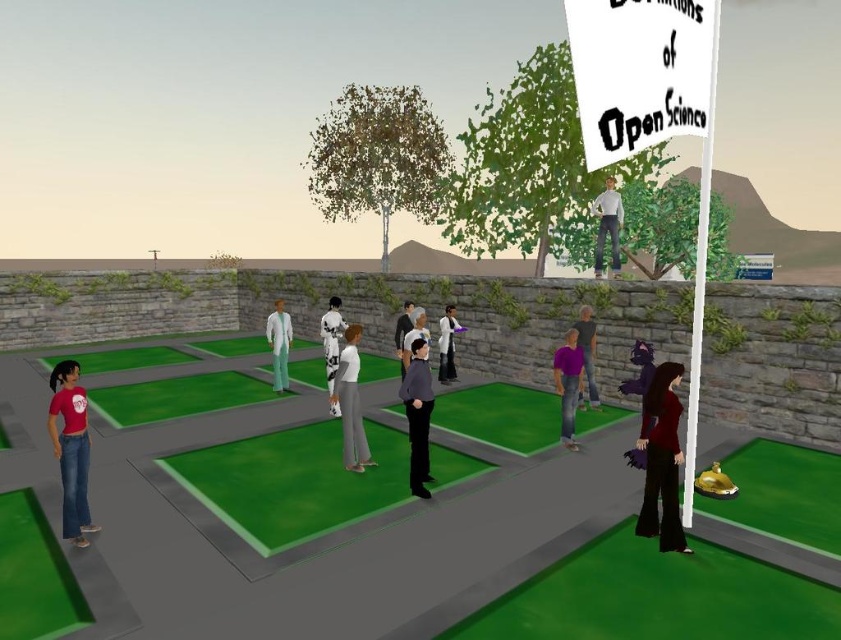
Is point (353, 408) more distant than point (586, 360)?

No, it is in front of (586, 360).

Which is in front, point (356, 442) or point (590, 371)?

Point (356, 442) is more forward.

Locate an element on the screen. The width and height of the screenshot is (841, 640). matte gray pants at center is located at coordinates (350, 403).

Between point (83, 522) and point (422, 492), which one is positioned in front?

Point (83, 522) is in front.

Is point (61, 449) in front of point (402, 394)?

Yes, point (61, 449) is closer to viewer.

Between point (75, 477) and point (421, 448), which one is positioned in front?

Point (75, 477) is more forward.

Find the location of `matte red t-shirt at lower left`. matte red t-shirt at lower left is located at coordinates (71, 449).

Between point (590, 374) and point (410, 317), which one is positioned behind?

The point (410, 317) is behind.

Is point (586, 308) closer to viewer compared to point (399, 324)?

Yes, it is in front of point (399, 324).

Is point (594, 346) closer to camera compared to point (405, 332)?

Yes, point (594, 346) is closer to viewer.

What are the coordinates of `purple fabric dress at center` in the screenshot? It's located at (586, 355).